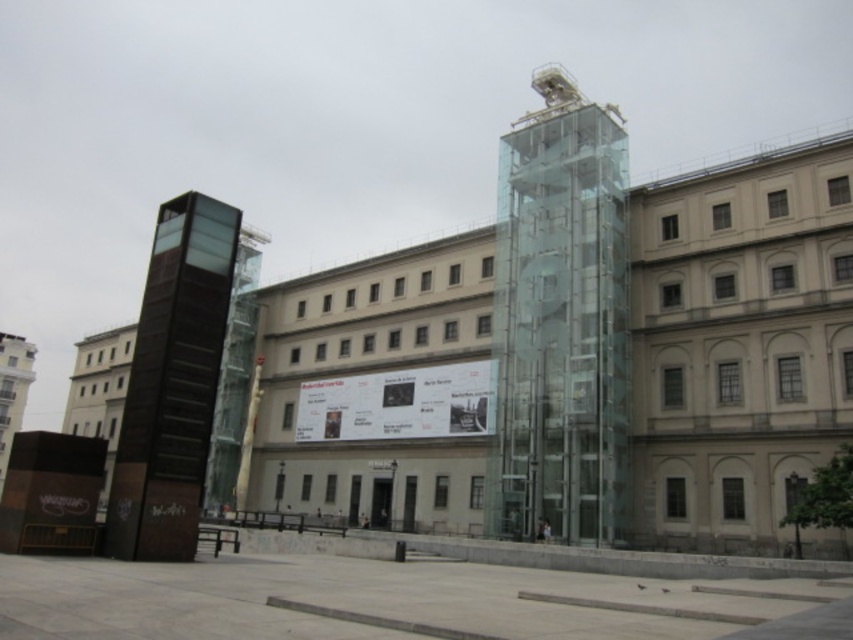
Question: Which point is closer to the camera?

Choices:
 (A) transparent glass tower at center
 (B) dark brown polished stone tower at left

Answer: (B)

Question: Which point is farther to the camera?

Choices:
 (A) (613, 256)
 (B) (119, 508)

Answer: (A)

Question: Can you confirm if transparent glass tower at center is bigger than dark brown polished stone tower at left?

Choices:
 (A) no
 (B) yes

Answer: (B)

Question: Is transparent glass tower at center closer to the viewer compared to dark brown polished stone tower at left?

Choices:
 (A) no
 (B) yes

Answer: (A)

Question: Among these points, which one is farthest from the camera?

Choices:
 (A) [538, 305]
 (B) [189, 490]

Answer: (A)

Question: Does transparent glass tower at center appear on the right side of dark brown polished stone tower at left?

Choices:
 (A) no
 (B) yes

Answer: (B)